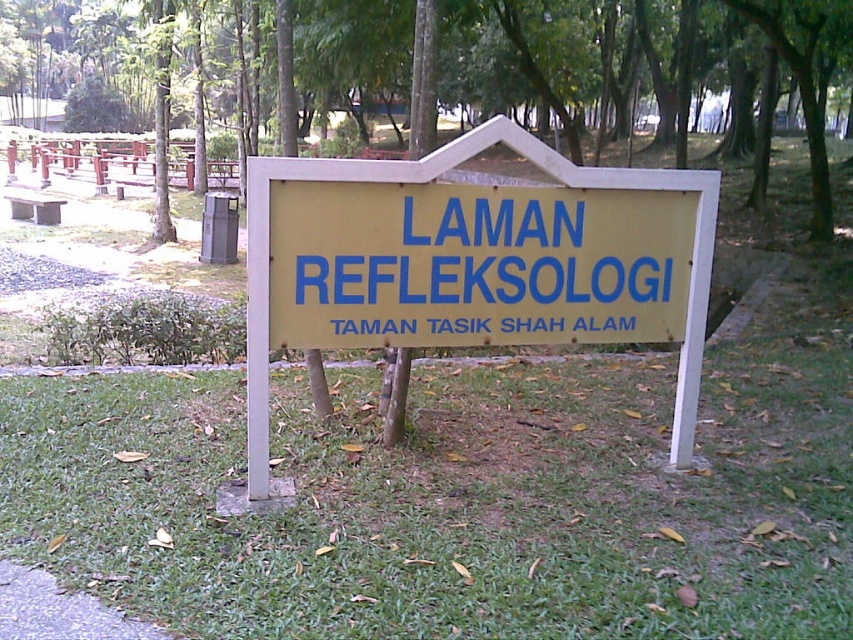
You are a park visitor who wants to read the yellow matte sign at center clearly. Since you are standing at the edge of the green grass at center, can you step forward to get a closer look without obstructing the view of the sign?

The green grass at center is in front of the yellow matte sign at center, so stepping forward from the edge of the green grass at center would bring you closer to the sign while still having an unobstructed view of it.

Based on the photo, you are a gardener who needs to place a new 3 feet wide flower pot between the green grass at center and the yellow matte signboard at center. Based on their widths, which object should the flower pot be placed closer to?

The green grass at center has a larger width than the yellow matte signboard at center, so the flower pot should be placed closer to the yellow matte signboard at center to ensure it fits within the available space.